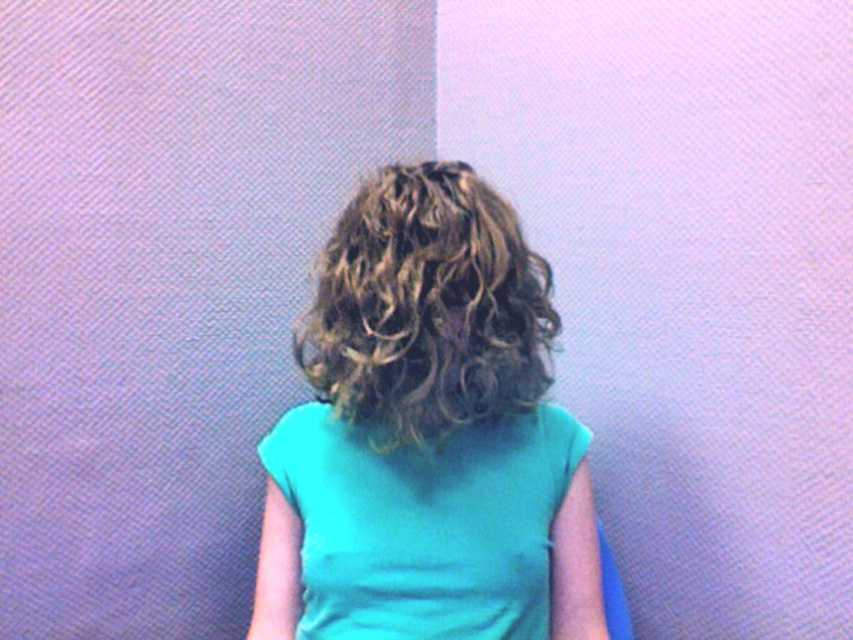
Where is `matte teal shirt at center`? This screenshot has height=640, width=853. matte teal shirt at center is located at coordinates (424, 525).

Does matte teal shirt at center have a smaller size compared to curly blonde hair at center?

Indeed, matte teal shirt at center has a smaller size compared to curly blonde hair at center.

Identify the location of matte teal shirt at center. (424, 525).

This screenshot has height=640, width=853. I want to click on matte teal shirt at center, so [x=424, y=525].

Is teal fabric girl at center bigger than curly blonde hair at center?

Indeed, teal fabric girl at center has a larger size compared to curly blonde hair at center.

Consider the image. Is teal fabric girl at center to the left of curly blonde hair at center from the viewer's perspective?

Incorrect, teal fabric girl at center is not on the left side of curly blonde hair at center.

Locate an element on the screen. This screenshot has width=853, height=640. teal fabric girl at center is located at coordinates (427, 312).

You are a GUI agent. You are given a task and a screenshot of the screen. Output one action in this format:
    pyautogui.click(x=<x>, y=<y>)
    Task: Click on the teal fabric girl at center
    The image size is (853, 640).
    Given the screenshot: What is the action you would take?
    pyautogui.click(x=427, y=312)

Who is higher up, teal fabric girl at center or matte teal shirt at center?

teal fabric girl at center is above.

Between teal fabric girl at center and matte teal shirt at center, which one appears on the right side from the viewer's perspective?

teal fabric girl at center

Between point (457, 204) and point (289, 417), which one is positioned in front?

Point (457, 204) is more forward.

Where is `teal fabric girl at center`? teal fabric girl at center is located at coordinates (427, 312).